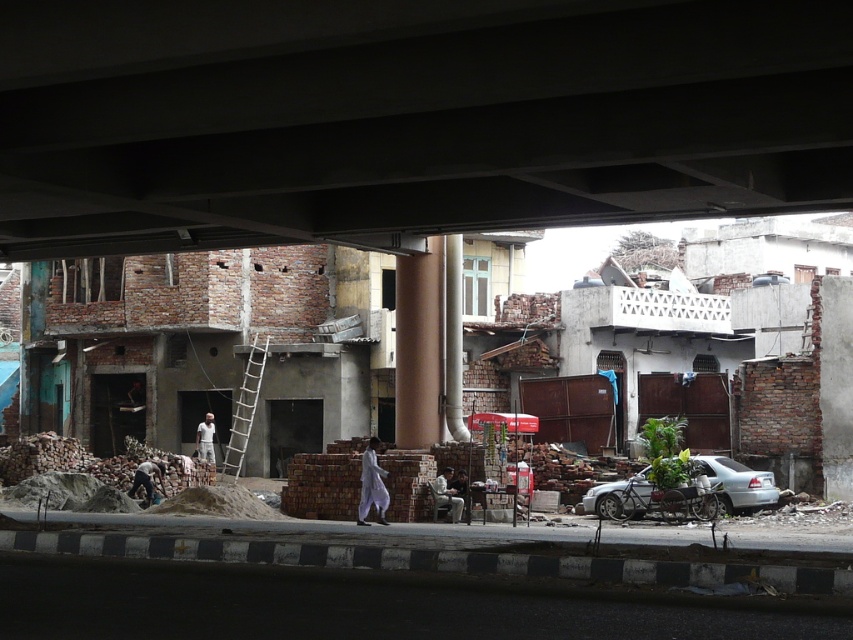
You are a delivery person trying to navigate through the construction site. You see a white wooden ladder at center and a white cotton shirt at center. Which object should you avoid stepping on to ensure safety?

You should avoid stepping on the white cotton shirt at center because the white wooden ladder at center might be wider and more stable for walking around.

You are standing at the construction site under the bridge and want to reach the two points marked in the image. Which point, point (398, 4) or point (720, 493), is closer to your current position?

Point (398, 4) is closer to the camera than point (720, 493), so it is closer to your current position.

You are a delivery driver approaching the construction site. You need to navigate under the dark gray concrete overpass at upper center. Based on the scene description, where is the overpass positioned relative to the road and construction site?

The dark gray concrete overpass at upper center is located at point (409, 116), which places it above the construction site and road, forming the upper portion of the frame. Drivers must pass under it to navigate the area.